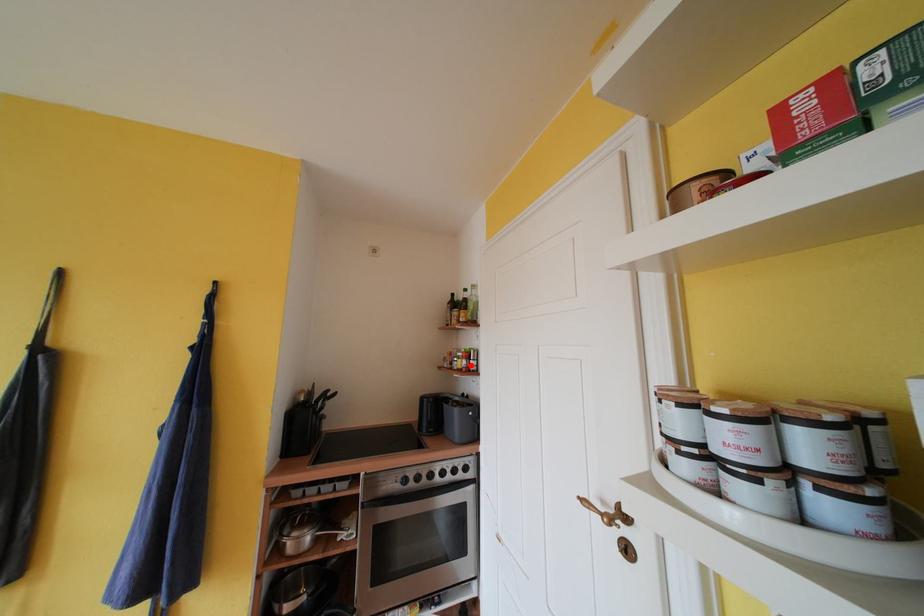
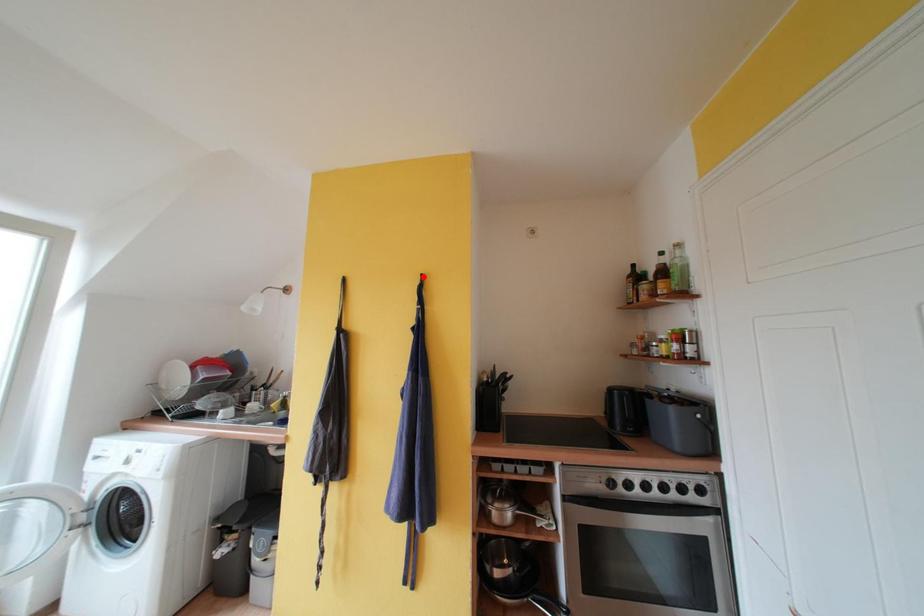
I am providing you with two images of the same scene from different viewpoints. A red point is marked on the first image and another point is marked on the second image. Is the red point in image1 aligned with the point shown in image2?

No